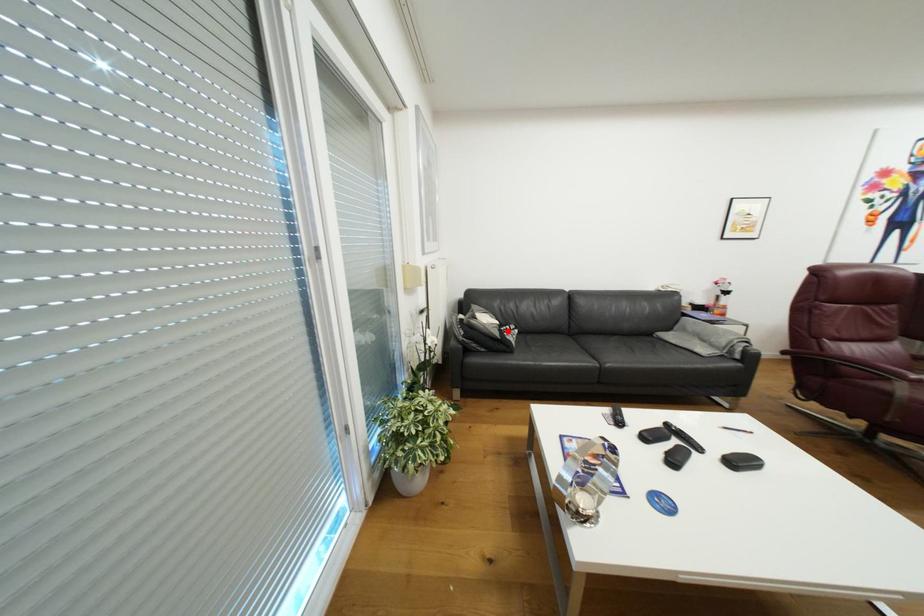
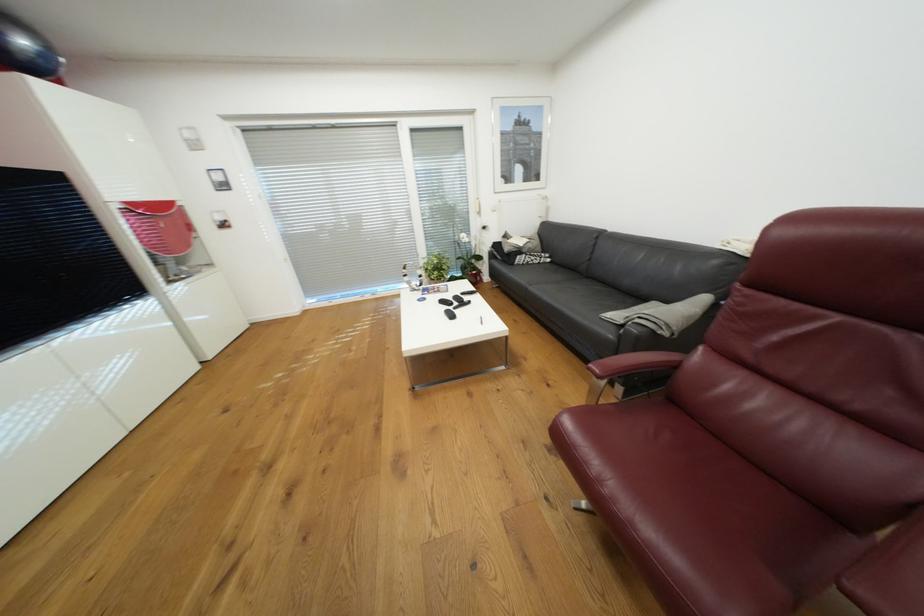
Where in the second image is the point corresponding to the highlighted location from the first image?

(526, 252)